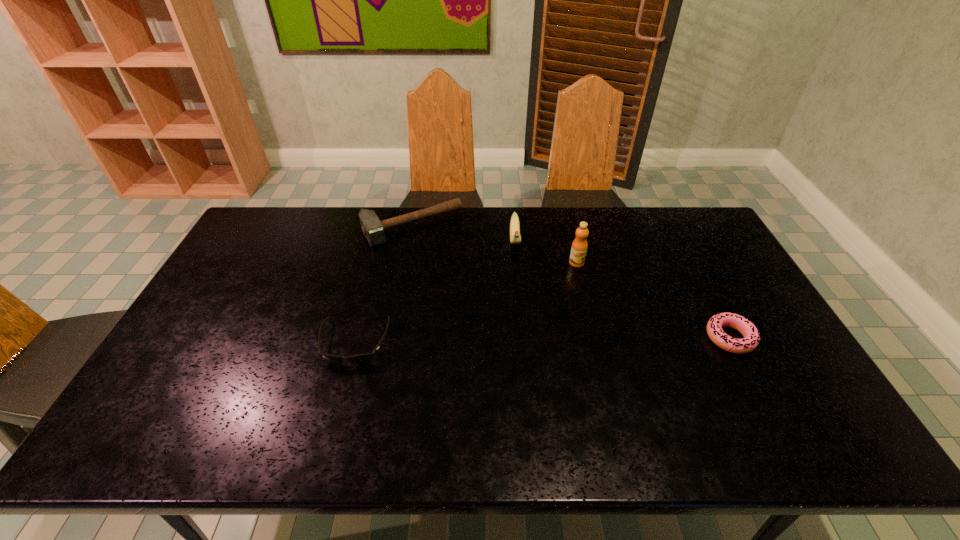
Where is `vacant point located between the third shortest object and the sunglasses`? This screenshot has width=960, height=540. vacant point located between the third shortest object and the sunglasses is located at coordinates (383, 285).

Where is `vacant space that's between the sunglasses and the rightmost object`? vacant space that's between the sunglasses and the rightmost object is located at coordinates (542, 340).

Identify the location of vacant region between the sunglasses and the third object from right to left. The image size is (960, 540). (435, 292).

Where is `free space between the second object from right to left and the sunglasses`? Image resolution: width=960 pixels, height=540 pixels. free space between the second object from right to left and the sunglasses is located at coordinates (466, 302).

Identify the location of vacant region between the rightmost object and the banana. The width and height of the screenshot is (960, 540). (622, 289).

What are the coordinates of `vacant area between the orange juice and the sunglasses` in the screenshot? It's located at (466, 302).

Identify which object is the nearest to the tallest object. Please provide its 2D coordinates. Your answer should be formatted as a tuple, i.e. [(x, y)], where the tuple contains the x and y coordinates of a point satisfying the conditions above.

[(515, 238)]

This screenshot has height=540, width=960. What are the coordinates of `object that ranks as the second closest to the second tallest object` in the screenshot? It's located at (373, 229).

Identify the location of free space that satisfies the following two spatial constraints: 1. on the front side of the tallest object; 2. on the left side of the rightmost object. (595, 338).